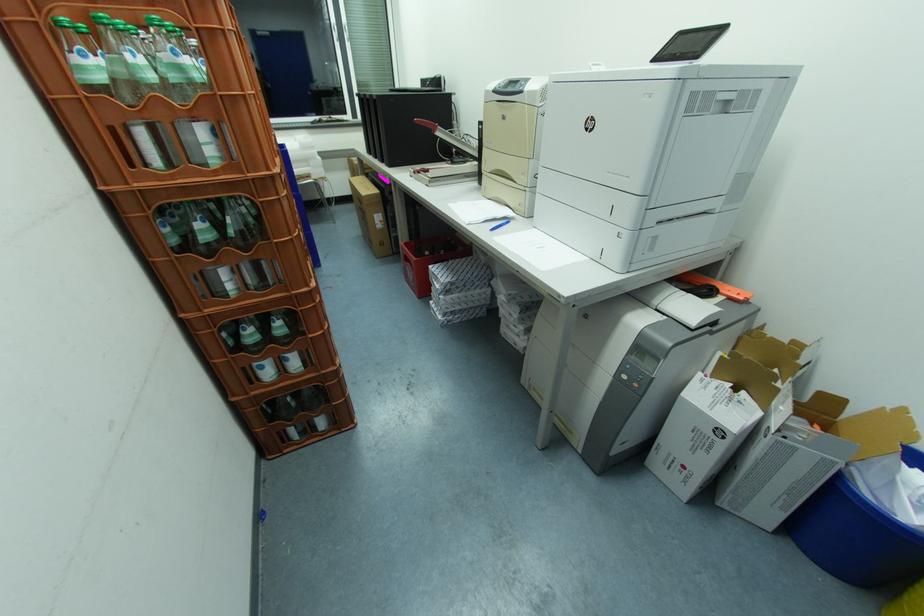
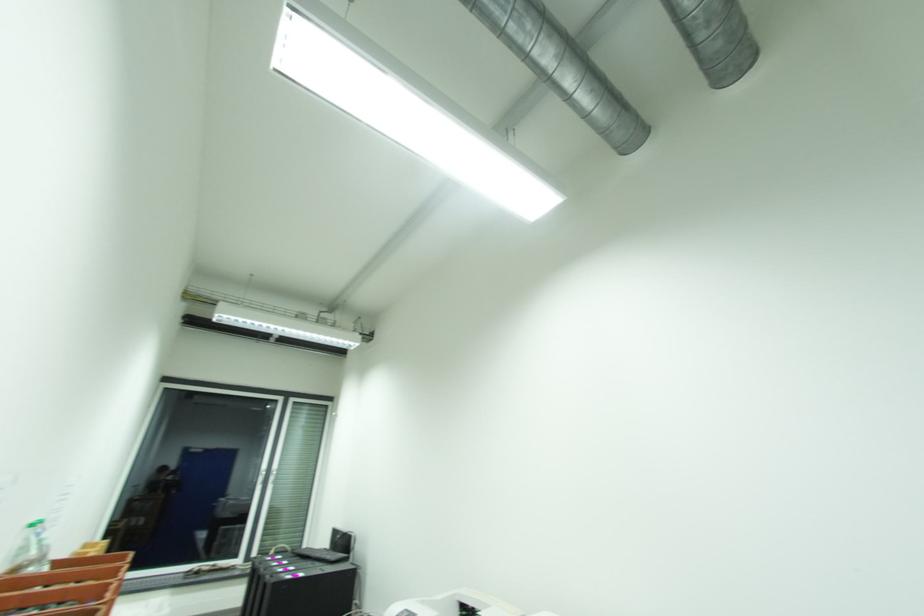
How did the camera likely rotate?

The camera's rotation is toward right-up.